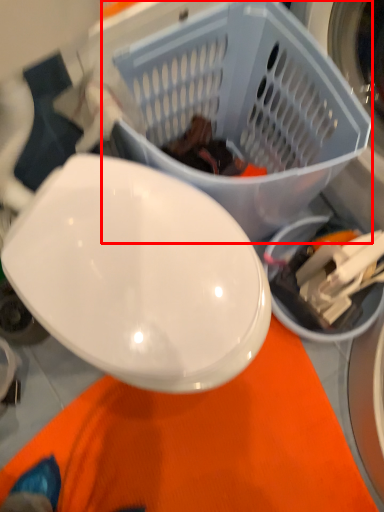
Question: From the image, what is the correct spatial relationship of basket (annotated by the red box) in relation to food?

Choices:
 (A) left
 (B) right

Answer: (B)